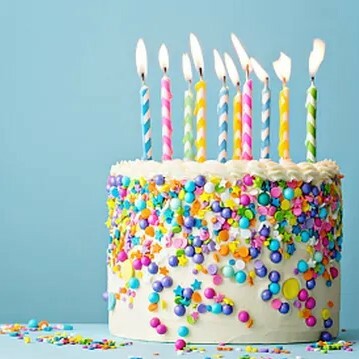
Where is `candle`? This screenshot has width=359, height=359. candle is located at coordinates (148, 137), (169, 130), (191, 112), (203, 102), (226, 108), (238, 105), (249, 102), (265, 111), (289, 109), (312, 114).